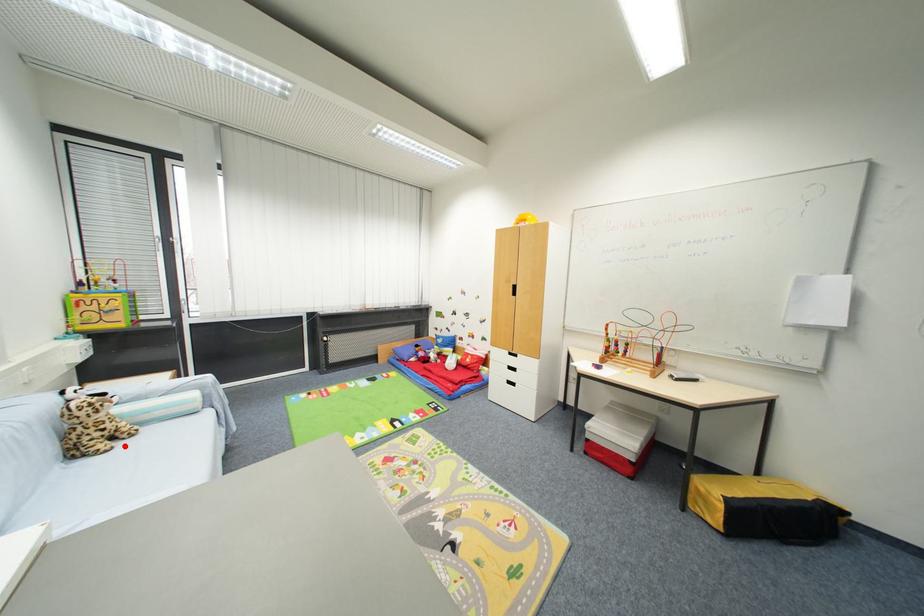
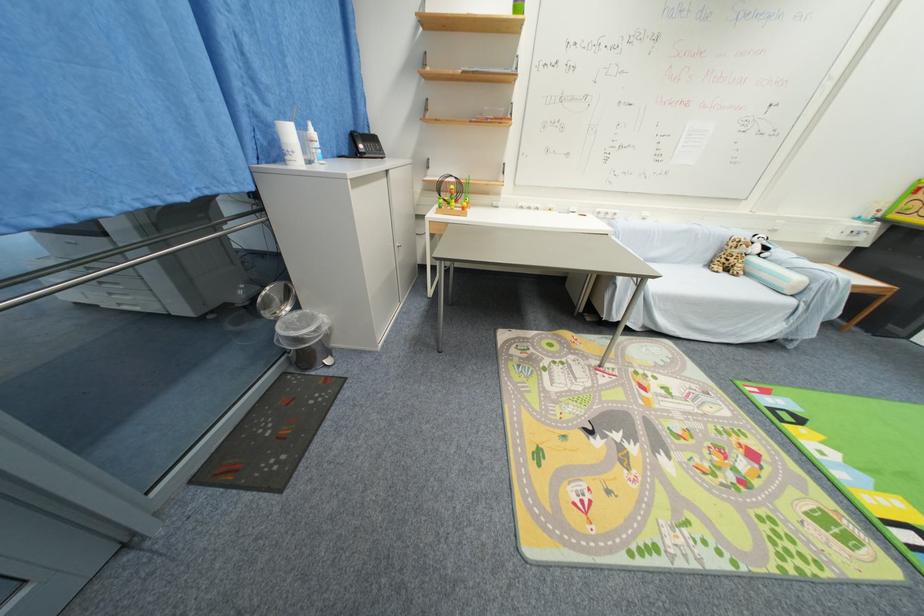
Locate, in the second image, the point that corresponds to the highlighted location in the first image.

(730, 276)